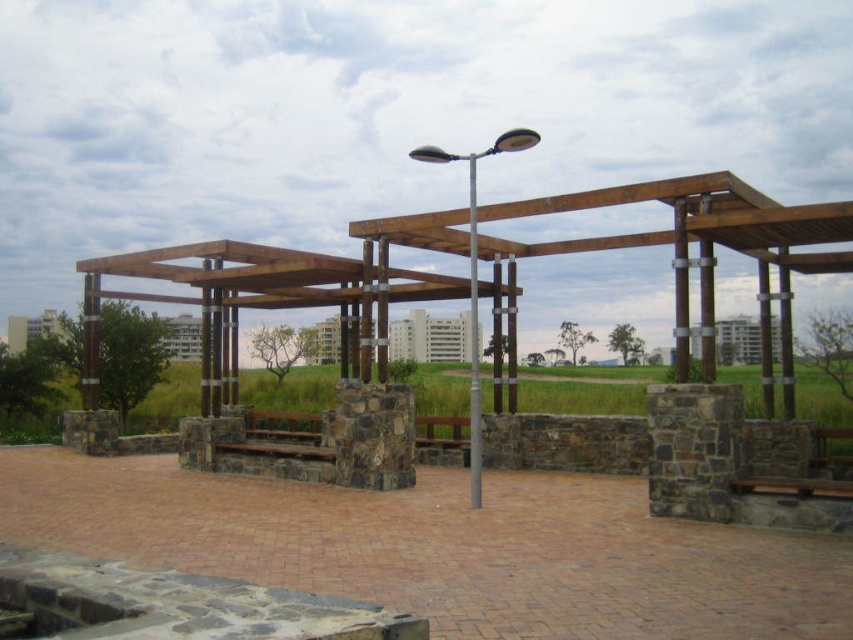
Which is above, metallic pole at center or wooden bench at center?

metallic pole at center is above.

Who is more distant from viewer, (469, 493) or (456, 417)?

The point (456, 417) is more distant.

Is point (474, 326) farther from viewer compared to point (416, 420)?

No, it is in front of (416, 420).

The image size is (853, 640). I want to click on metallic pole at center, so click(473, 342).

From the picture: Who is positioned more to the left, brown wooden bench at center or wooden bench at center?

brown wooden bench at center is more to the left.

Is brown wooden bench at center further to camera compared to wooden bench at center?

That is True.

What do you see at coordinates (283, 426) in the screenshot? The height and width of the screenshot is (640, 853). I see `brown wooden bench at center` at bounding box center [283, 426].

Locate an element on the screen. brown wooden bench at center is located at coordinates point(283,426).

Does metallic pole at center appear on the left side of brown wooden bench at center?

Incorrect, metallic pole at center is not on the left side of brown wooden bench at center.

Does metallic pole at center appear on the right side of brown wooden bench at center?

Indeed, metallic pole at center is positioned on the right side of brown wooden bench at center.

Between point (469, 250) and point (283, 413), which one is positioned behind?

The point (283, 413) is more distant.

Where is `metallic pole at center`? metallic pole at center is located at coordinates (473, 342).